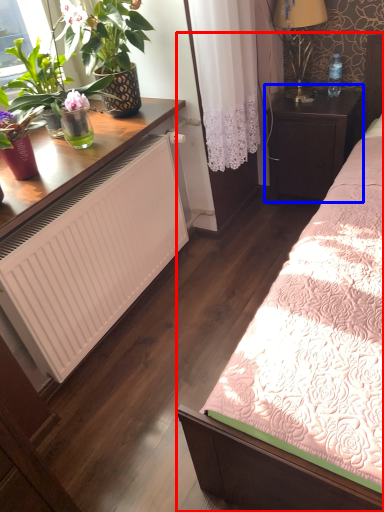
Question: Which object is closer to the camera taking this photo, bed (highlighted by a red box) or table (highlighted by a blue box)?

Choices:
 (A) bed
 (B) table

Answer: (A)